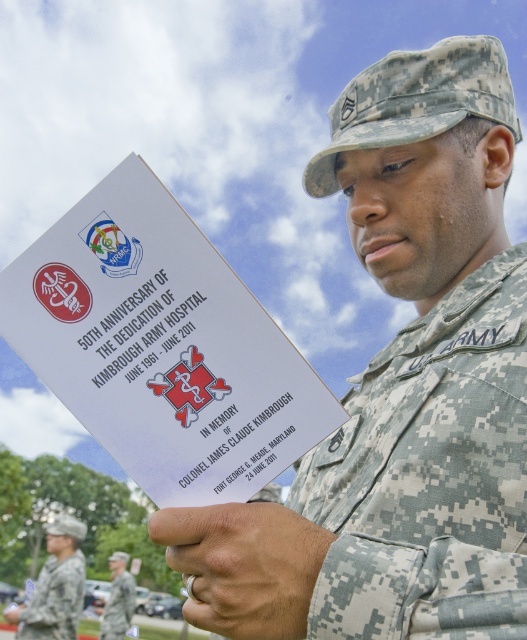
Question: Does camouflage uniform at center lie in front of camouflage fabric us army uniform at center?

Choices:
 (A) yes
 (B) no

Answer: (B)

Question: Which point is closer to the camera?

Choices:
 (A) (229, 532)
 (B) (77, 618)
 (C) (475, 252)
 (D) (336, 628)

Answer: (D)

Question: Based on their relative distances, which object is nearer to the camouflage fabric uniform at lower left?

Choices:
 (A) matte camouflage ring at lower center
 (B) camouflage fabric uniform at center
 (C) camouflage fabric us army uniform at center

Answer: (B)

Question: Does camouflage uniform at center have a greater width compared to camouflage fabric uniform at center?

Choices:
 (A) no
 (B) yes

Answer: (B)

Question: Is camouflage fabric us army uniform at center to the left of camouflage fabric uniform at lower left from the viewer's perspective?

Choices:
 (A) yes
 (B) no

Answer: (B)

Question: Among these objects, which one is nearest to the camera?

Choices:
 (A) camouflage fabric us army uniform at center
 (B) matte camouflage ring at lower center
 (C) camouflage uniform at center
 (D) camouflage fabric uniform at center

Answer: (A)